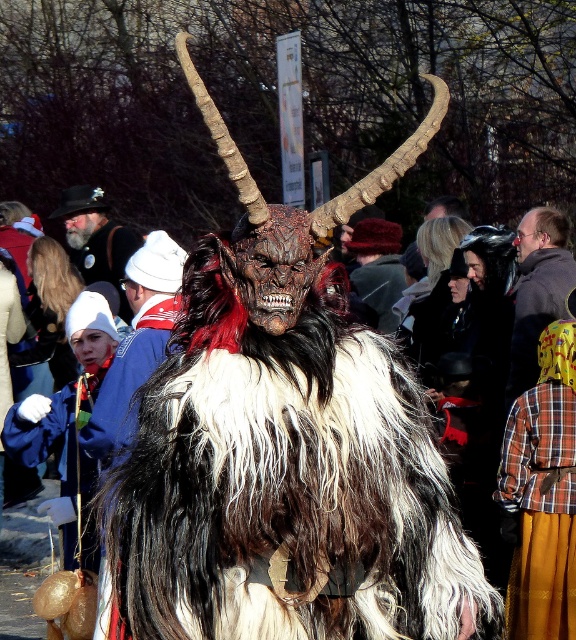
You are a photographer at the event and want to capture a photo of both the furry costume at center and the velvet red hat at center in the same frame. Since you need to adjust your camera settings based on their sizes, which object should you focus on first to ensure it appears clear in the photo?

The furry costume at center is taller than the velvet red hat at center, so you should focus on the furry costume at center first to ensure its full height is captured clearly before adjusting for the smaller velvet red hat at center.